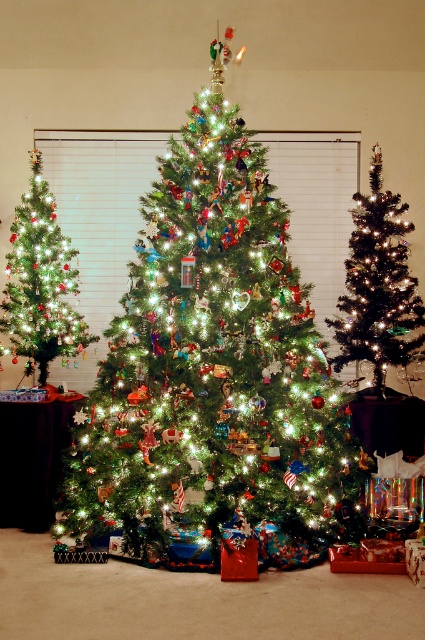
Question: Which point is farther to the camera?

Choices:
 (A) shiny silver christmas tree at center
 (B) iridescent glass ornaments at center
 (C) green matte christmas tree at left

Answer: (A)

Question: Is iridescent glass ornaments at center bigger than shiny silver christmas tree at center?

Choices:
 (A) yes
 (B) no

Answer: (A)

Question: Which object appears closest to the camera in this image?

Choices:
 (A) shiny silver christmas tree at center
 (B) green matte christmas tree at left

Answer: (B)

Question: Does iridescent glass ornaments at center have a larger size compared to shiny silver christmas tree at center?

Choices:
 (A) yes
 (B) no

Answer: (A)

Question: Can you confirm if shiny silver christmas tree at center is wider than green matte christmas tree at left?

Choices:
 (A) no
 (B) yes

Answer: (B)

Question: Which of the following is the closest to the observer?

Choices:
 (A) (218, 241)
 (B) (14, 220)
 (C) (396, 364)

Answer: (A)